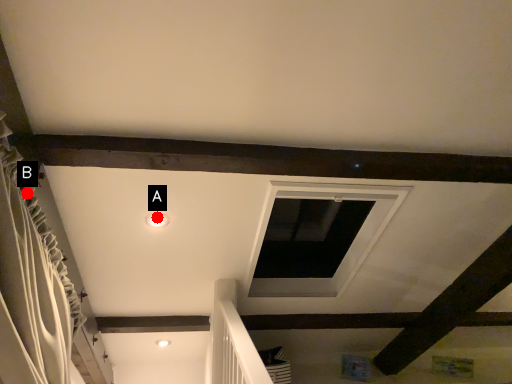
Question: Two points are circled on the image, labeled by A and B beside each circle. Among these points, which one is nearest to the camera?

Choices:
 (A) A is closer
 (B) B is closer

Answer: (B)